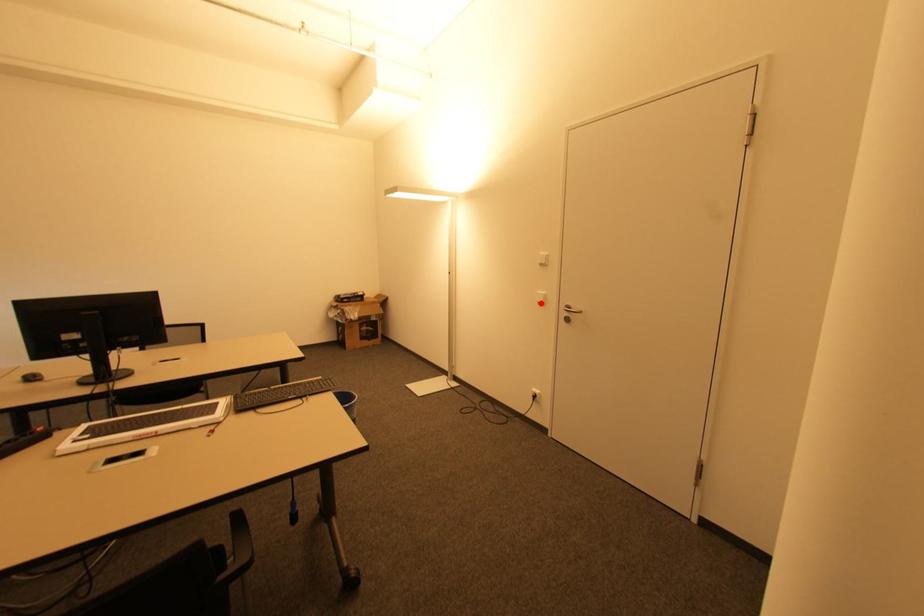
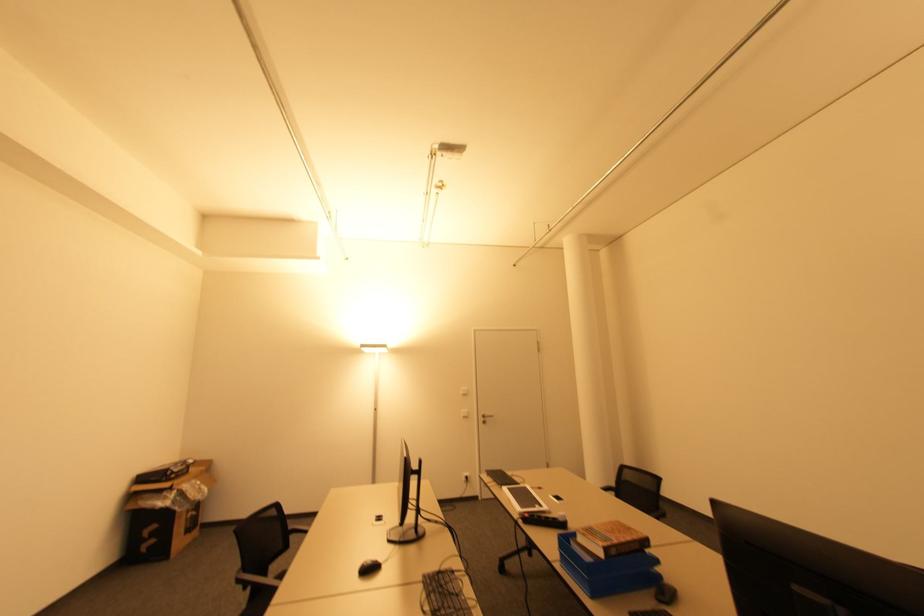
Where in the second image is the point corresponding to the highlighted location from the first image?

(467, 416)